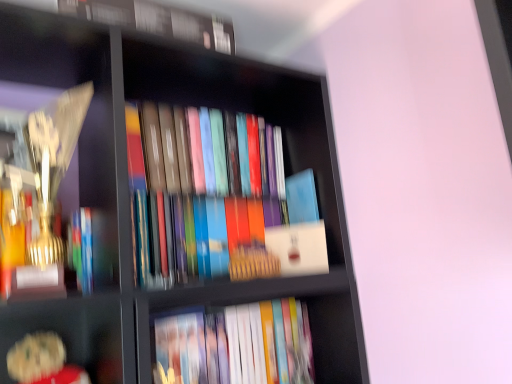
Measure the distance between matte hardcover book at lower center, which is the 1th book in bottom-to-top order, and camera.

The depth of matte hardcover book at lower center, which is the 1th book in bottom-to-top order, is 32.22 inches.

Locate an element on the screen. This screenshot has height=384, width=512. white matte book at center, the first paperback book in the bottom-to-top sequence is located at coordinates (298, 248).

Find the location of a particular element. This screenshot has height=384, width=512. hardcover book at upper center, acting as the 1th book starting from the top is located at coordinates (157, 20).

Considering the relative sizes of matte hardcover book at lower center, placed as the second book when sorted from top to bottom, and white matte book at center, arranged as the 2th paperback book when viewed from the top, in the image provided, is matte hardcover book at lower center, placed as the second book when sorted from top to bottom, taller than white matte book at center, arranged as the 2th paperback book when viewed from the top,?

Yes.

Considering the relative positions of matte hardcover book at lower center, placed as the second book when sorted from top to bottom, and white matte book at center, the first paperback book in the bottom-to-top sequence, in the image provided, is matte hardcover book at lower center, placed as the second book when sorted from top to bottom, behind white matte book at center, the first paperback book in the bottom-to-top sequence,?

No, matte hardcover book at lower center, placed as the second book when sorted from top to bottom, is closer to the viewer.

From the image's perspective, is matte hardcover book at lower center, placed as the second book when sorted from top to bottom, above white matte book at center, arranged as the 2th paperback book when viewed from the top?

No.

Would you say matte hardcover book at lower center, placed as the second book when sorted from top to bottom, is a long distance from white matte book at center, arranged as the 2th paperback book when viewed from the top?

No, matte hardcover book at lower center, placed as the second book when sorted from top to bottom, is not far from white matte book at center, arranged as the 2th paperback book when viewed from the top.

Which of these two, matte hardcover book at lower center, placed as the second book when sorted from top to bottom, or blue matte book at center, which is counted as the 2th paperback book, starting from the bottom, is smaller?

blue matte book at center, which is counted as the 2th paperback book, starting from the bottom, is smaller.

Between matte hardcover book at lower center, which is the 1th book in bottom-to-top order, and blue matte book at center, which is counted as the 2th paperback book, starting from the bottom, which one has more height?

Standing taller between the two is matte hardcover book at lower center, which is the 1th book in bottom-to-top order.

Is matte hardcover book at lower center, which is the 1th book in bottom-to-top order, looking in the opposite direction of blue matte book at center, marked as the 1th paperback book in a top-to-bottom arrangement?

matte hardcover book at lower center, which is the 1th book in bottom-to-top order, is not turned away from blue matte book at center, marked as the 1th paperback book in a top-to-bottom arrangement.

Is matte hardcover book at lower center, which is the 1th book in bottom-to-top order, at the right side of blue matte book at center, which is counted as the 2th paperback book, starting from the bottom?

No, matte hardcover book at lower center, which is the 1th book in bottom-to-top order, is not to the right of blue matte book at center, which is counted as the 2th paperback book, starting from the bottom.

Is white matte book at center, the first paperback book in the bottom-to-top sequence, completely or partially outside of blue matte book at center, marked as the 1th paperback book in a top-to-bottom arrangement?

Indeed, white matte book at center, the first paperback book in the bottom-to-top sequence, is completely outside blue matte book at center, marked as the 1th paperback book in a top-to-bottom arrangement.

Is white matte book at center, the first paperback book in the bottom-to-top sequence, looking in the opposite direction of blue matte book at center, marked as the 1th paperback book in a top-to-bottom arrangement?

No, white matte book at center, the first paperback book in the bottom-to-top sequence, is not facing the opposite direction of blue matte book at center, marked as the 1th paperback book in a top-to-bottom arrangement.

Is the surface of white matte book at center, arranged as the 2th paperback book when viewed from the top, in direct contact with blue matte book at center, marked as the 1th paperback book in a top-to-bottom arrangement?

Yes, white matte book at center, arranged as the 2th paperback book when viewed from the top, and blue matte book at center, marked as the 1th paperback book in a top-to-bottom arrangement, clearly make contact.

From a real-world perspective, does white matte book at center, arranged as the 2th paperback book when viewed from the top, sit lower than blue matte book at center, which is counted as the 2th paperback book, starting from the bottom?

Correct, in the physical world, white matte book at center, arranged as the 2th paperback book when viewed from the top, is lower than blue matte book at center, which is counted as the 2th paperback book, starting from the bottom.

This screenshot has width=512, height=384. In order to click on book on the right of hardcover book at upper center, which is counted as the second book, starting from the bottom in this screenshot , I will do `click(234, 346)`.

Is matte hardcover book at lower center, which is the 1th book in bottom-to-top order, located outside hardcover book at upper center, which is counted as the second book, starting from the bottom?

Yes, matte hardcover book at lower center, which is the 1th book in bottom-to-top order, is not within hardcover book at upper center, which is counted as the second book, starting from the bottom.

Who is bigger, matte hardcover book at lower center, which is the 1th book in bottom-to-top order, or hardcover book at upper center, acting as the 1th book starting from the top?

matte hardcover book at lower center, which is the 1th book in bottom-to-top order.

From a real-world perspective, does matte hardcover book at lower center, placed as the second book when sorted from top to bottom, sit lower than hardcover book at upper center, acting as the 1th book starting from the top?

Yes, from a real-world perspective, matte hardcover book at lower center, placed as the second book when sorted from top to bottom, is below hardcover book at upper center, acting as the 1th book starting from the top.

Measure the distance from blue matte book at center, which is counted as the 2th paperback book, starting from the bottom, to white matte book at center, the first paperback book in the bottom-to-top sequence.

They are 8.23 centimeters apart.

From a real-world perspective, which is physically below, blue matte book at center, which is counted as the 2th paperback book, starting from the bottom, or white matte book at center, arranged as the 2th paperback book when viewed from the top?

In real-world perspective, white matte book at center, arranged as the 2th paperback book when viewed from the top, is lower.

From the image's perspective, is blue matte book at center, which is counted as the 2th paperback book, starting from the bottom, positioned above or below white matte book at center, the first paperback book in the bottom-to-top sequence?

Based on their image positions, blue matte book at center, which is counted as the 2th paperback book, starting from the bottom, is located above white matte book at center, the first paperback book in the bottom-to-top sequence.

Can you confirm if blue matte book at center, which is counted as the 2th paperback book, starting from the bottom, is thinner than white matte book at center, the first paperback book in the bottom-to-top sequence?

Indeed, blue matte book at center, which is counted as the 2th paperback book, starting from the bottom, has a lesser width compared to white matte book at center, the first paperback book in the bottom-to-top sequence.

Can we say blue matte book at center, marked as the 1th paperback book in a top-to-bottom arrangement, lies outside hardcover book at upper center, which is counted as the second book, starting from the bottom?

Yes, blue matte book at center, marked as the 1th paperback book in a top-to-bottom arrangement, is not within hardcover book at upper center, which is counted as the second book, starting from the bottom.

Is the surface of blue matte book at center, marked as the 1th paperback book in a top-to-bottom arrangement, in direct contact with hardcover book at upper center, acting as the 1th book starting from the top?

No, blue matte book at center, marked as the 1th paperback book in a top-to-bottom arrangement, is not in contact with hardcover book at upper center, acting as the 1th book starting from the top.

Which object is thinner, white matte book at center, the first paperback book in the bottom-to-top sequence, or hardcover book at upper center, which is counted as the second book, starting from the bottom?

Thinner between the two is hardcover book at upper center, which is counted as the second book, starting from the bottom.

This screenshot has height=384, width=512. Find the location of `book that is the 2nd one when counting leftward from the white matte book at center, arranged as the 2th paperback book when viewed from the top`. book that is the 2nd one when counting leftward from the white matte book at center, arranged as the 2th paperback book when viewed from the top is located at coordinates (157, 20).

Considering the relative sizes of white matte book at center, arranged as the 2th paperback book when viewed from the top, and hardcover book at upper center, which is counted as the second book, starting from the bottom, in the image provided, is white matte book at center, arranged as the 2th paperback book when viewed from the top, taller than hardcover book at upper center, which is counted as the second book, starting from the bottom,?

Incorrect, the height of white matte book at center, arranged as the 2th paperback book when viewed from the top, is not larger of that of hardcover book at upper center, which is counted as the second book, starting from the bottom.

Considering the positions of points (302, 272) and (209, 21), is point (302, 272) closer to camera compared to point (209, 21)?

No, (302, 272) is behind (209, 21).

Where is `paperback book that is the 1st object above the matte hardcover book at lower center, placed as the second book when sorted from top to bottom (from a real-world perspective)`? This screenshot has height=384, width=512. paperback book that is the 1st object above the matte hardcover book at lower center, placed as the second book when sorted from top to bottom (from a real-world perspective) is located at coordinates (298, 248).

Locate an element on the screen. Image resolution: width=512 pixels, height=384 pixels. book that is under the blue matte book at center, marked as the 1th paperback book in a top-to-bottom arrangement (from a real-world perspective) is located at coordinates (234, 346).

Estimate the real-world distances between objects in this image. Which object is further from hardcover book at upper center, which is counted as the second book, starting from the bottom, matte hardcover book at lower center, which is the 1th book in bottom-to-top order, or blue matte book at center, which is counted as the 2th paperback book, starting from the bottom?

matte hardcover book at lower center, which is the 1th book in bottom-to-top order, is further to hardcover book at upper center, which is counted as the second book, starting from the bottom.

From the image, which object appears to be nearer to blue matte book at center, marked as the 1th paperback book in a top-to-bottom arrangement, hardcover book at upper center, acting as the 1th book starting from the top, or white matte book at center, arranged as the 2th paperback book when viewed from the top?

Based on the image, white matte book at center, arranged as the 2th paperback book when viewed from the top, appears to be nearer to blue matte book at center, marked as the 1th paperback book in a top-to-bottom arrangement.

Considering their positions, is white matte book at center, the first paperback book in the bottom-to-top sequence, positioned further to matte hardcover book at lower center, placed as the second book when sorted from top to bottom, than blue matte book at center, which is counted as the 2th paperback book, starting from the bottom?

blue matte book at center, which is counted as the 2th paperback book, starting from the bottom, is further to matte hardcover book at lower center, placed as the second book when sorted from top to bottom.

Which object lies nearer to the anchor point hardcover book at upper center, which is counted as the second book, starting from the bottom, white matte book at center, the first paperback book in the bottom-to-top sequence, or blue matte book at center, marked as the 1th paperback book in a top-to-bottom arrangement?

blue matte book at center, marked as the 1th paperback book in a top-to-bottom arrangement, is closer to hardcover book at upper center, which is counted as the second book, starting from the bottom.

Which object lies nearer to the anchor point hardcover book at upper center, acting as the 1th book starting from the top, matte hardcover book at lower center, which is the 1th book in bottom-to-top order, or white matte book at center, arranged as the 2th paperback book when viewed from the top?

Among the two, white matte book at center, arranged as the 2th paperback book when viewed from the top, is located nearer to hardcover book at upper center, acting as the 1th book starting from the top.

Looking at the image, which one is located closer to blue matte book at center, marked as the 1th paperback book in a top-to-bottom arrangement, matte hardcover book at lower center, placed as the second book when sorted from top to bottom, or white matte book at center, the first paperback book in the bottom-to-top sequence?

white matte book at center, the first paperback book in the bottom-to-top sequence, lies closer to blue matte book at center, marked as the 1th paperback book in a top-to-bottom arrangement, than the other object.

Considering their positions, is matte hardcover book at lower center, which is the 1th book in bottom-to-top order, positioned further to blue matte book at center, which is counted as the 2th paperback book, starting from the bottom, than hardcover book at upper center, acting as the 1th book starting from the top?

hardcover book at upper center, acting as the 1th book starting from the top, is further to blue matte book at center, which is counted as the 2th paperback book, starting from the bottom.

From the image, which object appears to be nearer to hardcover book at upper center, acting as the 1th book starting from the top, blue matte book at center, which is counted as the 2th paperback book, starting from the bottom, or white matte book at center, the first paperback book in the bottom-to-top sequence?

Among the two, blue matte book at center, which is counted as the 2th paperback book, starting from the bottom, is located nearer to hardcover book at upper center, acting as the 1th book starting from the top.

Where is `paperback book between blue matte book at center, which is counted as the 2th paperback book, starting from the bottom, and matte hardcover book at lower center, which is the 1th book in bottom-to-top order, in the vertical direction`? The image size is (512, 384). paperback book between blue matte book at center, which is counted as the 2th paperback book, starting from the bottom, and matte hardcover book at lower center, which is the 1th book in bottom-to-top order, in the vertical direction is located at coordinates (298, 248).

This screenshot has height=384, width=512. I want to click on paperback book between hardcover book at upper center, which is counted as the second book, starting from the bottom, and white matte book at center, the first paperback book in the bottom-to-top sequence, in the up-down direction, so click(302, 197).